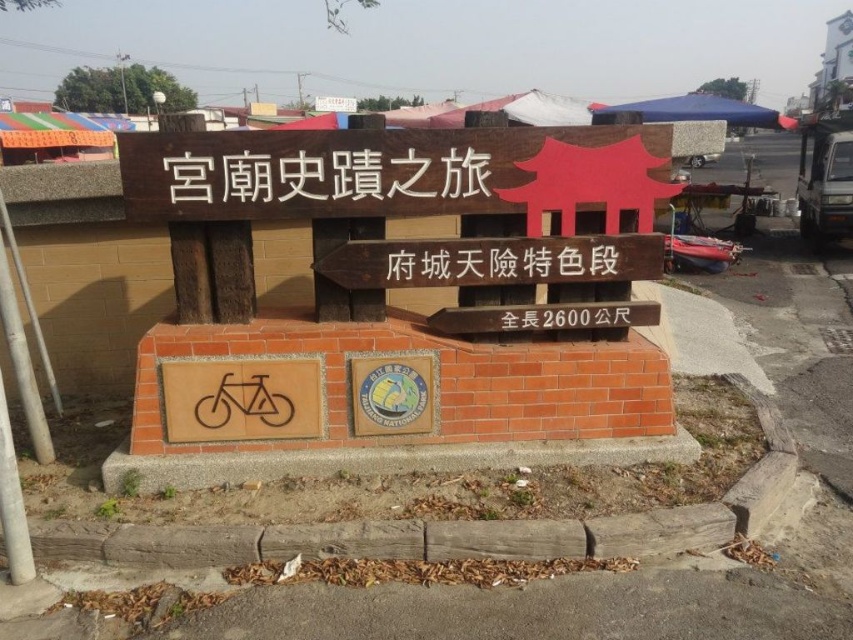
Which is in front, point (277, 381) or point (554, 321)?

Point (277, 381) is in front.

Identify the location of brown wood bicycle at center. (241, 397).

Is point (164, 426) in front of point (627, 317)?

Yes.

Find the location of `brown wood bicycle at center`. brown wood bicycle at center is located at coordinates (241, 397).

Does black wood sign at center appear over wooden signboard at center?

Yes, black wood sign at center is above wooden signboard at center.

At what (x,y) coordinates should I click in order to perform the action: click on black wood sign at center. Please return your answer as a coordinate pair (x, y). Looking at the image, I should click on (502, 260).

At what (x,y) coordinates should I click in order to perform the action: click on black wood sign at center. Please return your answer as a coordinate pair (x, y). Looking at the image, I should click on (502, 260).

In the scene shown: Can you confirm if brown wooden sign at center is shorter than black plastic text at center?

No.

Where is `brown wooden sign at center`? brown wooden sign at center is located at coordinates (326, 177).